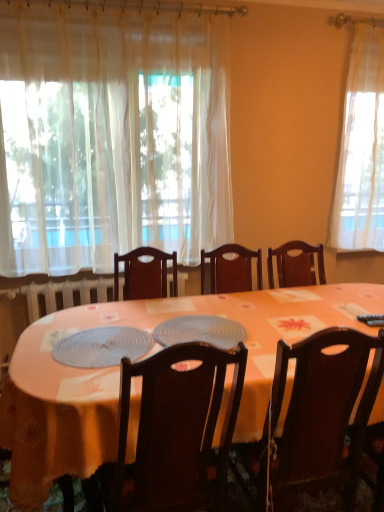
Locate an element on the screen. This screenshot has width=384, height=512. free point to the left of translucent plastic platter at center, positioned as the 1th platter in left-to-right order is located at coordinates (37, 344).